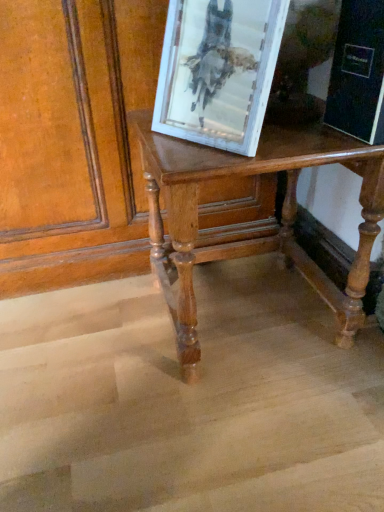
Locate an element on the screen. The image size is (384, 512). shiny polished wood table at center is located at coordinates (255, 238).

The image size is (384, 512). What do you see at coordinates (255, 238) in the screenshot? I see `shiny polished wood table at center` at bounding box center [255, 238].

What is the approximate width of shiny polished wood table at center?

16.15 inches.

What do you see at coordinates (218, 71) in the screenshot? The width and height of the screenshot is (384, 512). I see `white distressed wood picture frame at upper center` at bounding box center [218, 71].

Identify the location of white distressed wood picture frame at upper center. Image resolution: width=384 pixels, height=512 pixels. (218, 71).

In order to face white distressed wood picture frame at upper center, should I rotate leftwards or rightwards?

Turn right approximately 2.248 degrees to face it.

Find the location of a particular element. This screenshot has height=512, width=384. shiny polished wood table at center is located at coordinates (255, 238).

Which is more to the left, white distressed wood picture frame at upper center or shiny polished wood table at center?

white distressed wood picture frame at upper center is more to the left.

Which is in front, white distressed wood picture frame at upper center or shiny polished wood table at center?

white distressed wood picture frame at upper center is more forward.

Is point (255, 21) closer to viewer compared to point (329, 163)?

Yes.

From the image's perspective, between white distressed wood picture frame at upper center and shiny polished wood table at center, who is located below?

shiny polished wood table at center appears lower in the image.

From a real-world perspective, between white distressed wood picture frame at upper center and shiny polished wood table at center, who is vertically higher?

From a 3D spatial view, white distressed wood picture frame at upper center is above.

Is white distressed wood picture frame at upper center wider than shiny polished wood table at center?

No, white distressed wood picture frame at upper center is not wider than shiny polished wood table at center.

Is white distressed wood picture frame at upper center shorter than shiny polished wood table at center?

Indeed, white distressed wood picture frame at upper center has a lesser height compared to shiny polished wood table at center.

Who is bigger, white distressed wood picture frame at upper center or shiny polished wood table at center?

shiny polished wood table at center is bigger.

Is white distressed wood picture frame at upper center spatially inside shiny polished wood table at center, or outside of it?

white distressed wood picture frame at upper center is located beyond the bounds of shiny polished wood table at center.

Does white distressed wood picture frame at upper center touch shiny polished wood table at center?

No.

Does white distressed wood picture frame at upper center turn towards shiny polished wood table at center?

→ No.

What's the angular difference between white distressed wood picture frame at upper center and shiny polished wood table at center's facing directions?

The facing directions of white distressed wood picture frame at upper center and shiny polished wood table at center are 29.9 degrees apart.

Measure the distance from white distressed wood picture frame at upper center to shiny polished wood table at center.

They are 8.19 inches apart.

What are the coordinates of `picture frame in front of the shiny polished wood table at center` in the screenshot? It's located at (218, 71).

Can you confirm if shiny polished wood table at center is positioned to the right of white distressed wood picture frame at upper center?

Indeed, shiny polished wood table at center is positioned on the right side of white distressed wood picture frame at upper center.

Does shiny polished wood table at center lie behind white distressed wood picture frame at upper center?

Yes, it is.

Which is less distant, (x=204, y=156) or (x=258, y=15)?

Point (x=204, y=156) is positioned farther from the camera compared to point (x=258, y=15).

From the image's perspective, between shiny polished wood table at center and white distressed wood picture frame at upper center, who is located below?

shiny polished wood table at center appears lower in the image.

From a real-world perspective, is shiny polished wood table at center positioned over white distressed wood picture frame at upper center based on gravity?

Actually, shiny polished wood table at center is physically below white distressed wood picture frame at upper center in the real world.

Which object is wider, shiny polished wood table at center or white distressed wood picture frame at upper center?

shiny polished wood table at center is wider.

Is shiny polished wood table at center shorter than white distressed wood picture frame at upper center?

Incorrect, the height of shiny polished wood table at center does not fall short of that of white distressed wood picture frame at upper center.

Looking at the image, does shiny polished wood table at center seem bigger or smaller compared to white distressed wood picture frame at upper center?

Considering their sizes, shiny polished wood table at center takes up more space than white distressed wood picture frame at upper center.

Is white distressed wood picture frame at upper center surrounded by shiny polished wood table at center?

Definitely not — white distressed wood picture frame at upper center is not inside shiny polished wood table at center.

Is shiny polished wood table at center positioned far away from white distressed wood picture frame at upper center?

shiny polished wood table at center is actually quite close to white distressed wood picture frame at upper center.

Could you tell me if shiny polished wood table at center is facing white distressed wood picture frame at upper center?

No, shiny polished wood table at center is not facing towards white distressed wood picture frame at upper center.

How many degrees apart are the facing directions of shiny polished wood table at center and white distressed wood picture frame at upper center?

There is a 29.9-degree angle between the facing directions of shiny polished wood table at center and white distressed wood picture frame at upper center.

Locate an element on the screen. This screenshot has height=512, width=384. table below the white distressed wood picture frame at upper center (from the image's perspective) is located at coordinates (255, 238).

You are a GUI agent. You are given a task and a screenshot of the screen. Output one action in this format:
    pyautogui.click(x=<x>, y=<y>)
    Task: Click on the picture frame lying on the left of shiny polished wood table at center
    The image size is (384, 512).
    Given the screenshot: What is the action you would take?
    (218, 71)

The height and width of the screenshot is (512, 384). What are the coordinates of `table that appears on the right of white distressed wood picture frame at upper center` in the screenshot? It's located at 255,238.